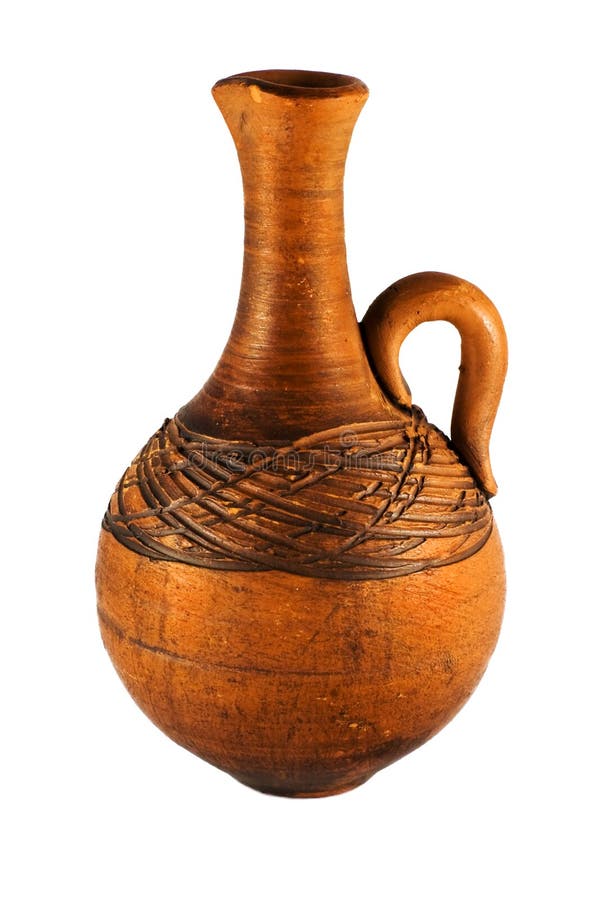
Where is `curved handle`? This screenshot has height=900, width=602. curved handle is located at coordinates (481, 374).